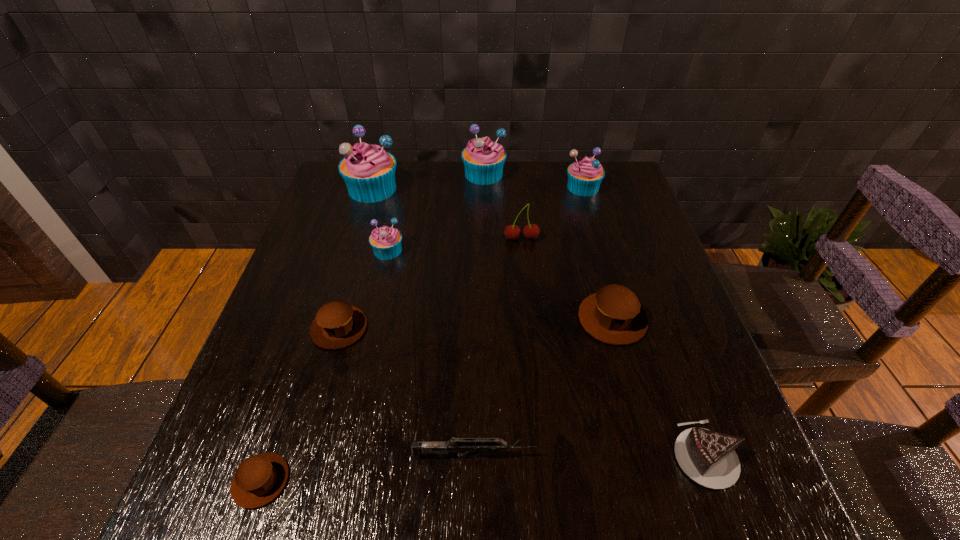
Image resolution: width=960 pixels, height=540 pixels. I want to click on vacant space located 0.080m on the left of the biggest brown muffin, so click(542, 320).

This screenshot has width=960, height=540. In order to click on free space located on the back of the sixth tallest muffin in this screenshot , I will do `click(360, 257)`.

You are a GUI agent. You are given a task and a screenshot of the screen. Output one action in this format:
    pyautogui.click(x=<x>, y=<y>)
    Task: Click on the blank space located 0.250m aimed along the barrel of the gun
    Image resolution: width=960 pixels, height=540 pixels.
    Given the screenshot: What is the action you would take?
    pyautogui.click(x=680, y=456)

At what (x,y) coordinates should I click in order to perform the action: click on vacant space positioned 0.100m on the back of the chocolate cake. Please return your answer as a coordinate pair (x, y). This screenshot has height=540, width=960. Looking at the image, I should click on (676, 375).

What are the coordinates of `free space located on the right of the shortest object` in the screenshot? It's located at (463, 481).

Where is `chocolate cake that is positioned at the near edge`? The image size is (960, 540). chocolate cake that is positioned at the near edge is located at coordinates (708, 457).

This screenshot has width=960, height=540. Identify the location of muffin present at the near edge. (259, 479).

The height and width of the screenshot is (540, 960). Find the location of `chocolate cake located at the right edge`. chocolate cake located at the right edge is located at coordinates (708, 457).

Identify the location of object that is at the far left corner. This screenshot has height=540, width=960. (368, 170).

Where is `object located in the near left corner section of the desktop`? Image resolution: width=960 pixels, height=540 pixels. object located in the near left corner section of the desktop is located at coordinates (259, 479).